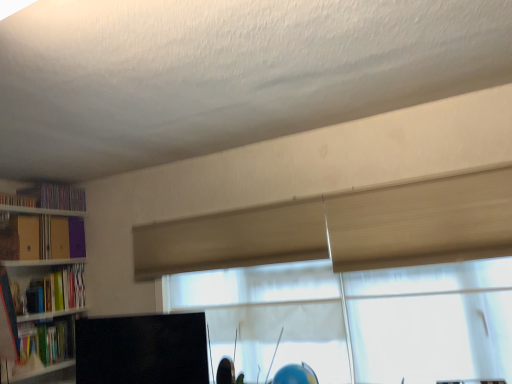
Question: Is translucent fabric window at center next to matte green book at left, placed as the fifth book when sorted from top to bottom?

Choices:
 (A) no
 (B) yes

Answer: (A)

Question: Can you confirm if translucent fabric window at center is bigger than matte green book at left, which ranks as the 1th book in bottom-to-top order?

Choices:
 (A) yes
 (B) no

Answer: (A)

Question: Is translucent fabric window at center taller than matte green book at left, placed as the fifth book when sorted from top to bottom?

Choices:
 (A) yes
 (B) no

Answer: (A)

Question: Is translucent fabric window at center positioned behind matte green book at left, placed as the fifth book when sorted from top to bottom?

Choices:
 (A) yes
 (B) no

Answer: (B)

Question: Is translucent fabric window at center outside matte green book at left, placed as the fifth book when sorted from top to bottom?

Choices:
 (A) yes
 (B) no

Answer: (A)

Question: Is wooden bookshelf at left bigger or smaller than hardcover book at left, positioned as the 4th book in top-to-bottom order?

Choices:
 (A) small
 (B) big

Answer: (B)

Question: From a real-world perspective, is wooden bookshelf at left physically located above or below hardcover book at left, which appears as the second book when ordered from the bottom?

Choices:
 (A) above
 (B) below

Answer: (B)

Question: Considering the positions of wooden bookshelf at left and hardcover book at left, positioned as the 4th book in top-to-bottom order, in the image, is wooden bookshelf at left wider or thinner than hardcover book at left, positioned as the 4th book in top-to-bottom order,?

Choices:
 (A) thin
 (B) wide

Answer: (B)

Question: Is wooden bookshelf at left to the left or to the right of hardcover book at left, which appears as the second book when ordered from the bottom, in the image?

Choices:
 (A) left
 (B) right

Answer: (B)

Question: Is hardcover book at left, which appears as the second book when ordered from the bottom, wider or thinner than translucent fabric window at center?

Choices:
 (A) thin
 (B) wide

Answer: (B)

Question: Is hardcover book at left, which appears as the second book when ordered from the bottom, bigger or smaller than translucent fabric window at center?

Choices:
 (A) big
 (B) small

Answer: (B)

Question: From a real-world perspective, relative to translucent fabric window at center, is hardcover book at left, positioned as the 4th book in top-to-bottom order, vertically above or below?

Choices:
 (A) below
 (B) above

Answer: (B)

Question: Considering the positions of hardcover book at left, positioned as the 4th book in top-to-bottom order, and translucent fabric window at center in the image, is hardcover book at left, positioned as the 4th book in top-to-bottom order, taller or shorter than translucent fabric window at center?

Choices:
 (A) tall
 (B) short

Answer: (B)

Question: Is point (35, 200) closer or farther from the camera than point (25, 230)?

Choices:
 (A) closer
 (B) farther

Answer: (B)

Question: Considering the positions of matte plastic bookshelf at left, the fourth book in the bottom-to-top sequence, and matte yellow folder at left, the third book from the top, in the image, is matte plastic bookshelf at left, the fourth book in the bottom-to-top sequence, taller or shorter than matte yellow folder at left, the third book from the top,?

Choices:
 (A) short
 (B) tall

Answer: (A)